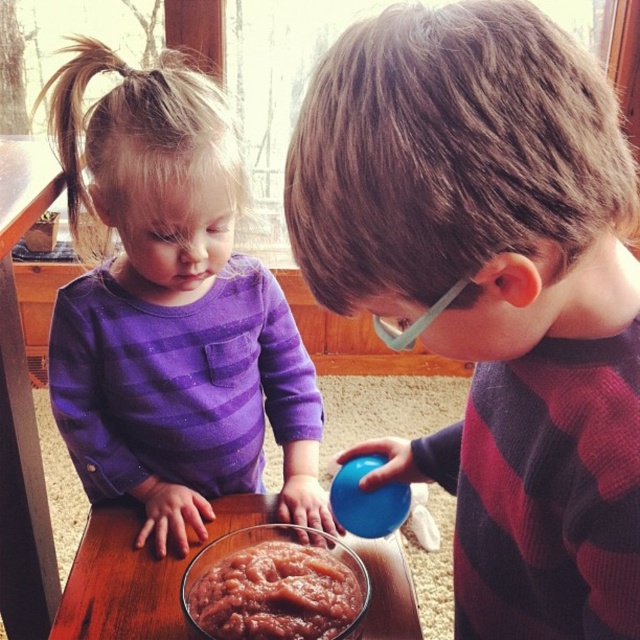
You are a parent trying to find the blue rubber ball at center for your child. Where would you look in relation to the purple soft fabric at upper left?

The blue rubber ball at center is located below the purple soft fabric at upper left, so you should look downward from the purple soft fabric at upper left to find it.

You are standing in front of the wooden table where the two children are playing. You want to place a new object exactly where the blue rubber ball at center is currently located. What are the coordinates of the point where you should place the new object?

The coordinates for the blue rubber ball at center are at point (x=492, y=292).